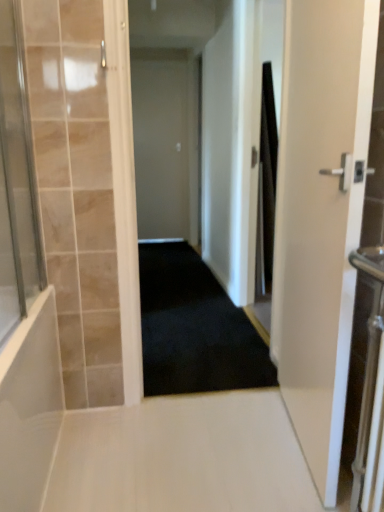
I want to click on empty space that is ontop of white matte door at center, which ranks as the 2th door in right-to-left order (from a real-world perspective), so click(172, 55).